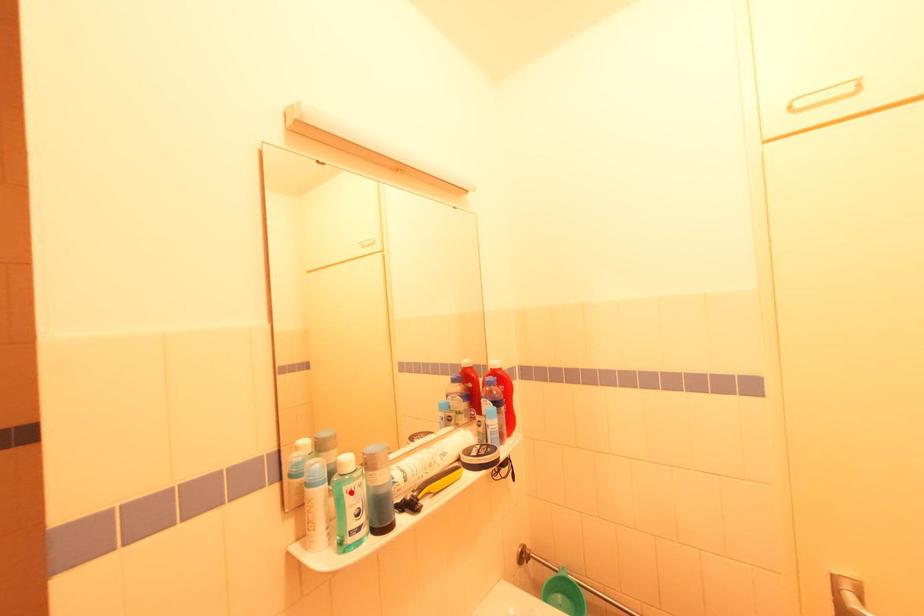
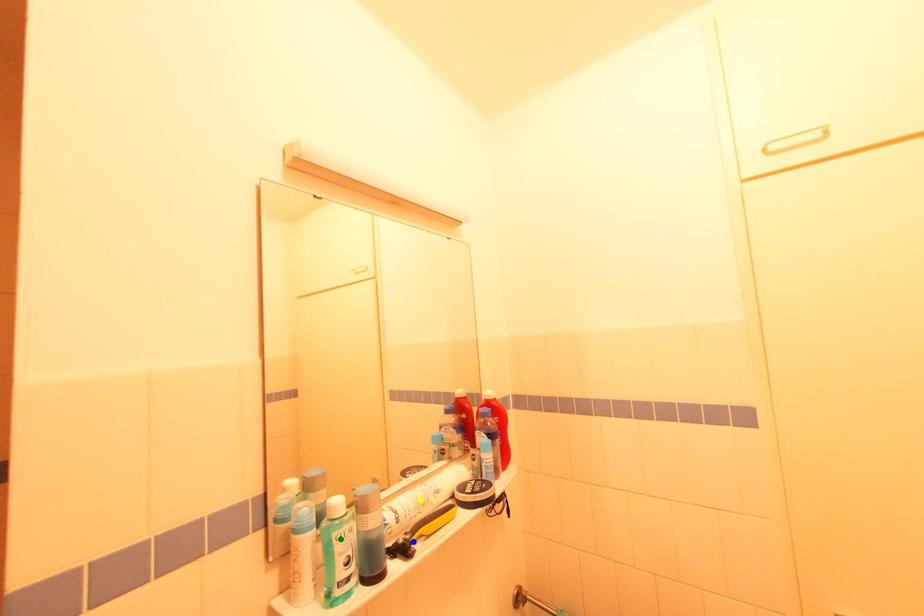
Question: I am providing you with two images of the same scene from different viewpoints. A red point is marked on the first image. You are given multiple points on the second image. Which spot in image 2 lines up with the point in image 1?

Choices:
 (A) blue point
 (B) yellow point
 (C) green point

Answer: (C)